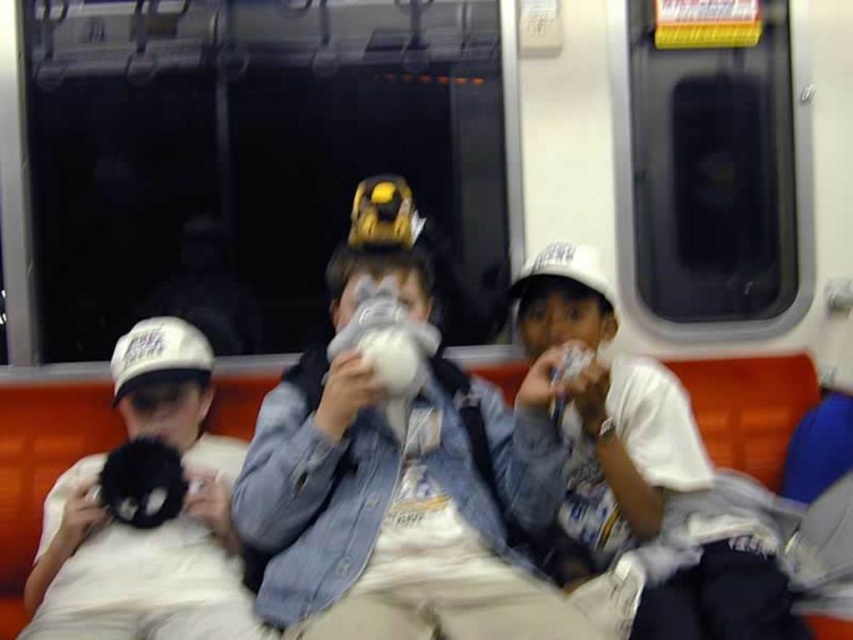
You are standing on the subway train and want to ask the boy in the denim jacket at center a question. To do so, you need to walk towards him. Based on the 2D coordinates provided, in which direction should you move relative to your current position?

The denim jacket at center is located at coordinates point [402,506]. Since the coordinate system typically places the origin at the bottom left corner, moving towards the denim jacket at center would require moving to the upper right direction from your current position.

You are a photographer standing in the subway train and want to take a photo of the white cotton shirt at right and the black plush toy at left. Which object will appear larger in the photo?

The white cotton shirt at right will appear larger in the photo because it is much taller than the black plush toy at left.